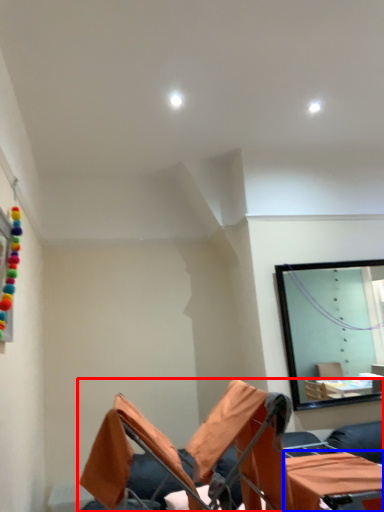
Question: Which object is closer to the camera taking this photo, furniture (highlighted by a red box) or table (highlighted by a blue box)?

Choices:
 (A) furniture
 (B) table

Answer: (A)